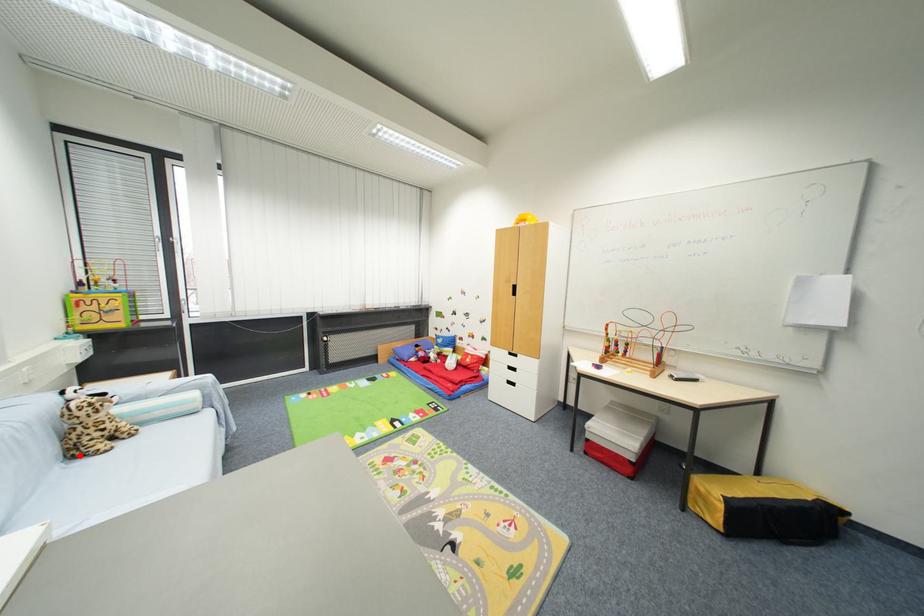
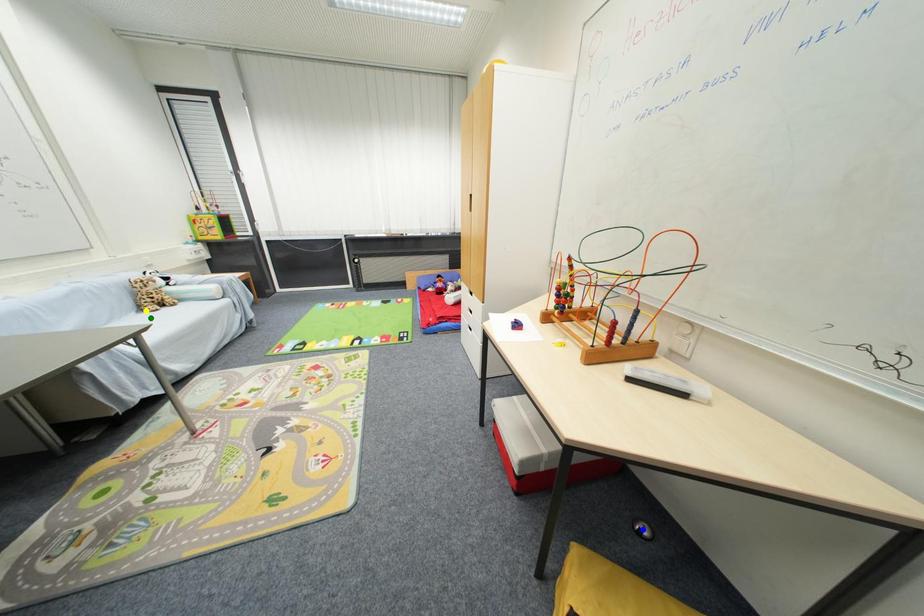
Question: I am providing you with two images of the same scene from different viewpoints. A red point is marked on the first image. You are given multiple points on the second image. Which point in image 2 represents the same 3d spot as the red point in image 1?

Choices:
 (A) yellow point
 (B) green point
 (C) blue point

Answer: (A)